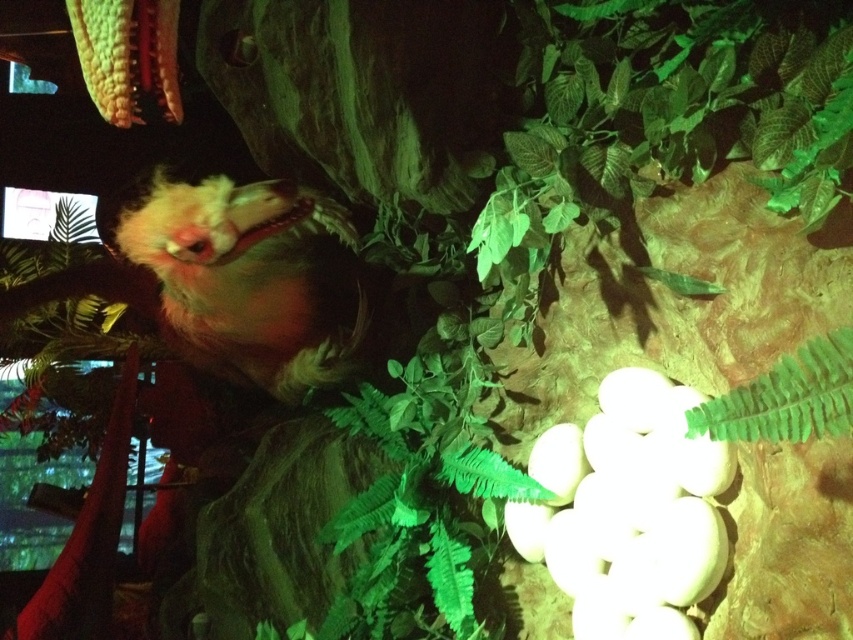
You are a visitor at this prehistoric exhibit and want to take a photo of both the fluffy yellow bird at upper left and the green leafy fern at lower right. Which object should you focus on first if you want to capture both in the same frame without moving your camera?

The fluffy yellow bird at upper left is taller than the green leafy fern at lower right, so you should focus on the fluffy yellow bird at upper left first to ensure both fit in the frame.